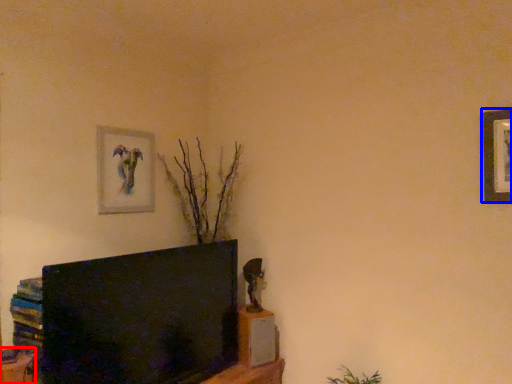
Question: Which point is closer to the camera, furniture (highlighted by a red box) or picture frame (highlighted by a blue box)?

Choices:
 (A) furniture
 (B) picture frame

Answer: (B)